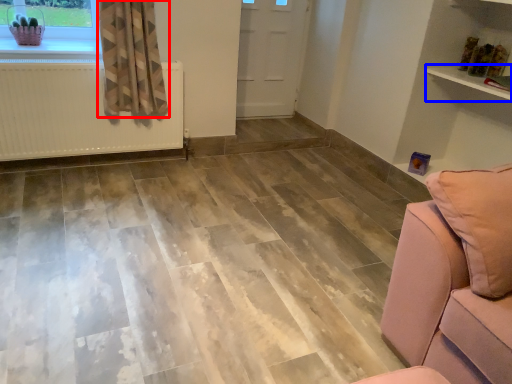
Question: Which point is closer to the camera, curtain (highlighted by a red box) or shelf (highlighted by a blue box)?

Choices:
 (A) curtain
 (B) shelf

Answer: (B)